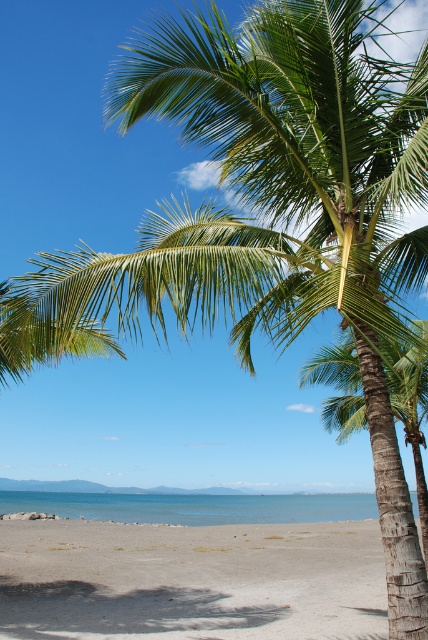
You are standing on the light brown sandy beach at lower center and want to walk to the blue water at lower center. Which direction should you move to reach the water quickly?

Since the light brown sandy beach at lower center is narrower than the blue water at lower center, you should move forward towards the blue water at lower center as it is closer and wider.

You are standing on the light brown sandy beach at lower center and looking towards the blue water at lower center. Which area covers more ground in the image?

The light brown sandy beach at lower center covers more ground than the blue water at lower center in the image.